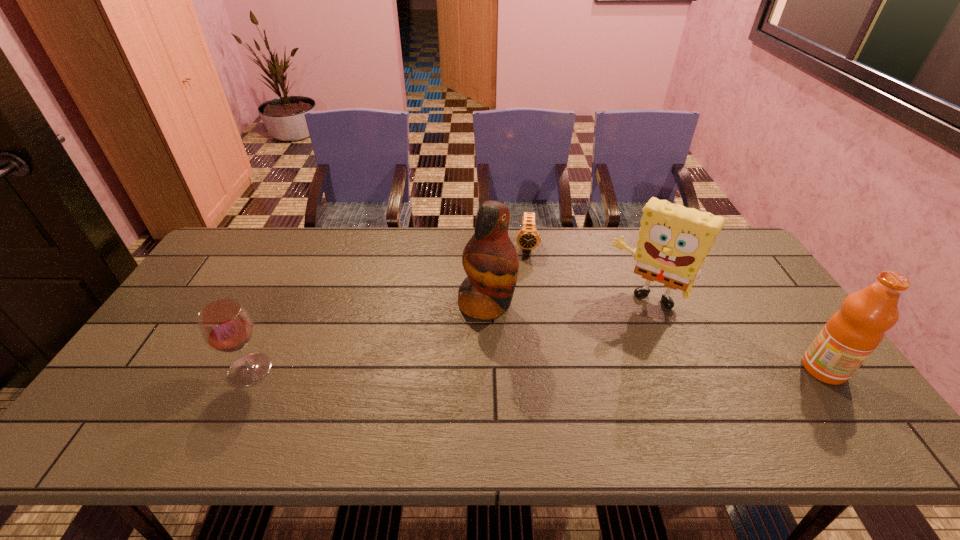
The image size is (960, 540). In order to click on vacant space that satisfies the following two spatial constraints: 1. on the back side of the fourth object from left to right; 2. on the right side of the parrot in this screenshot , I will do `click(487, 298)`.

Where is `vacant area in the image that satisfies the following two spatial constraints: 1. on the front side of the fourth object from right to left; 2. on the label side of the fruit juice`? The width and height of the screenshot is (960, 540). vacant area in the image that satisfies the following two spatial constraints: 1. on the front side of the fourth object from right to left; 2. on the label side of the fruit juice is located at coordinates (488, 369).

This screenshot has width=960, height=540. I want to click on vacant point that satisfies the following two spatial constraints: 1. on the front side of the rightmost object; 2. on the label side of the parrot, so click(x=488, y=369).

At what (x,y) coordinates should I click in order to perform the action: click on free region that satisfies the following two spatial constraints: 1. on the back side of the second object from right to left; 2. on the left side of the parrot. Please return your answer as a coordinate pair (x, y). This screenshot has width=960, height=540. Looking at the image, I should click on (487, 298).

You are a GUI agent. You are given a task and a screenshot of the screen. Output one action in this format:
    pyautogui.click(x=<x>, y=<y>)
    Task: Click on the free location that satisfies the following two spatial constraints: 1. on the front side of the farthest object; 2. on the label side of the rightmost object
    The image size is (960, 540).
    Given the screenshot: What is the action you would take?
    pyautogui.click(x=543, y=369)